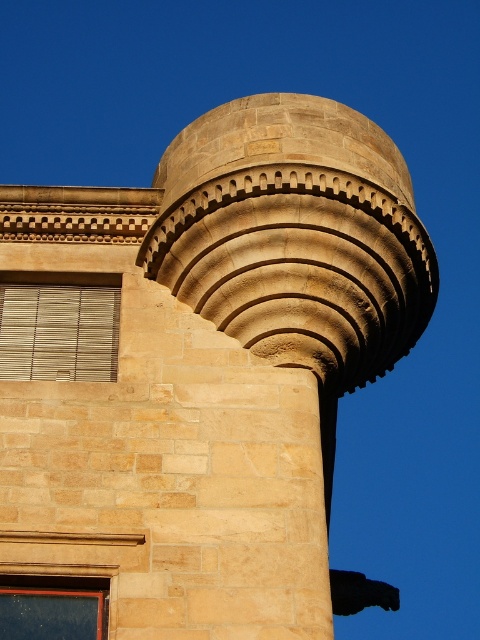
Question: Can you confirm if wooden slats at left is bigger than matte wooden window at lower left?

Choices:
 (A) no
 (B) yes

Answer: (B)

Question: Does wooden slats at left have a lesser width compared to matte wooden window at lower left?

Choices:
 (A) yes
 (B) no

Answer: (B)

Question: Which point is closer to the camera?

Choices:
 (A) (60, 320)
 (B) (67, 600)

Answer: (B)

Question: In this image, where is wooden slats at left located relative to matte wooden window at lower left?

Choices:
 (A) left
 (B) right

Answer: (A)

Question: Which point is closer to the camera taking this photo?

Choices:
 (A) (58, 305)
 (B) (81, 600)

Answer: (B)